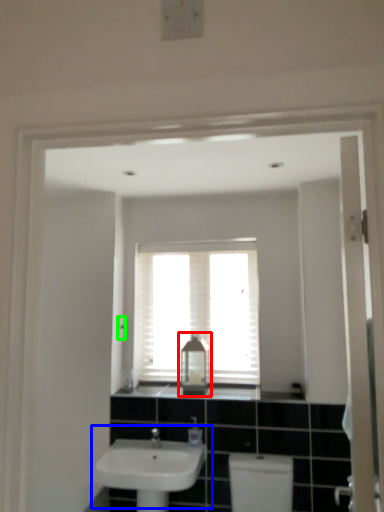
Question: Considering the real-world distances, which object is farthest from medicine cabinet (highlighted by a red box)? sink (highlighted by a blue box) or light switch (highlighted by a green box)?

Choices:
 (A) sink
 (B) light switch

Answer: (B)